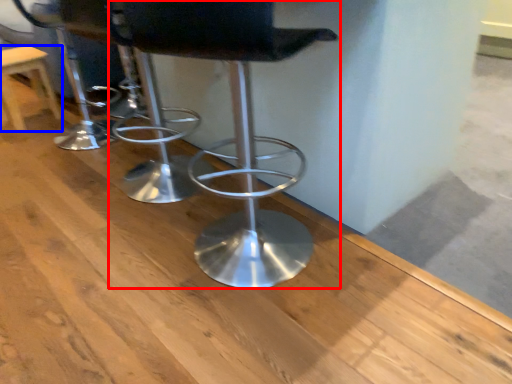
Question: Which point is further to the camera, chair (highlighted by a red box) or stool (highlighted by a blue box)?

Choices:
 (A) chair
 (B) stool

Answer: (B)